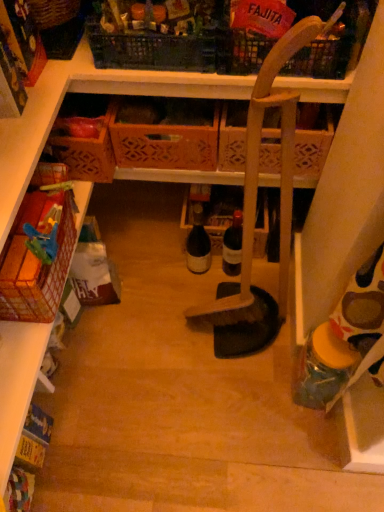
Identify the location of unoccupied area behind wooden broom at center. The height and width of the screenshot is (512, 384). (205, 280).